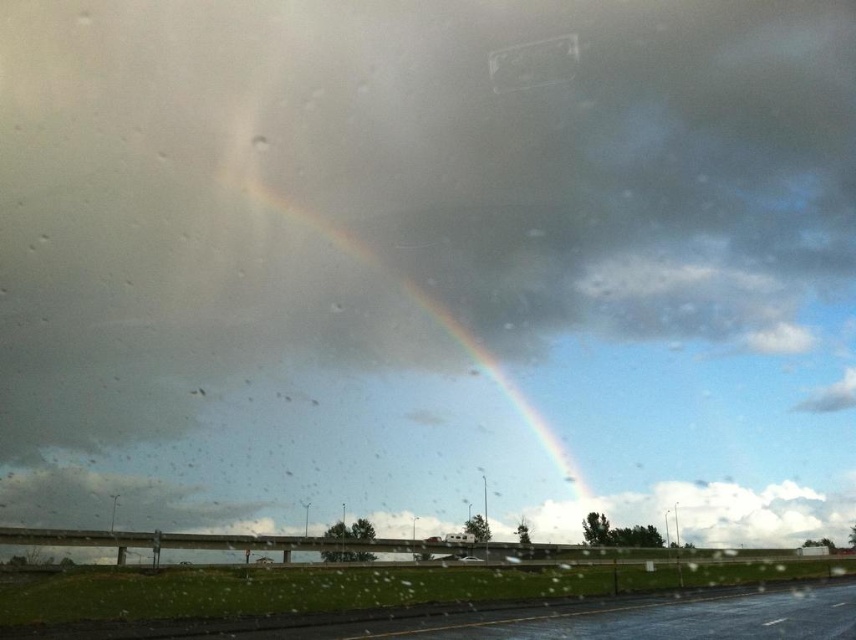
Is rainbow at upper center thinner than transparent plastic car window at upper center?

Incorrect, rainbow at upper center's width is not less than transparent plastic car window at upper center's.

How distant is rainbow at upper center from transparent plastic car window at upper center?

rainbow at upper center is 113.56 meters from transparent plastic car window at upper center.

The width and height of the screenshot is (856, 640). I want to click on rainbow at upper center, so click(503, 387).

From the picture: Is glossy asphalt highway at lower center above rainbow at upper center?

Incorrect, glossy asphalt highway at lower center is not positioned above rainbow at upper center.

Between glossy asphalt highway at lower center and rainbow at upper center, which one has less height?

glossy asphalt highway at lower center is shorter.

Locate an element on the screen. glossy asphalt highway at lower center is located at coordinates (535, 620).

Locate an element on the screen. glossy asphalt highway at lower center is located at coordinates (535, 620).

In the scene shown: Can you confirm if rainbow at upper center is thinner than white glossy car at center?

Incorrect, rainbow at upper center's width is not less than white glossy car at center's.

Can you confirm if rainbow at upper center is positioned to the left of white glossy car at center?

Yes, rainbow at upper center is to the left of white glossy car at center.

This screenshot has height=640, width=856. Identify the location of rainbow at upper center. (503, 387).